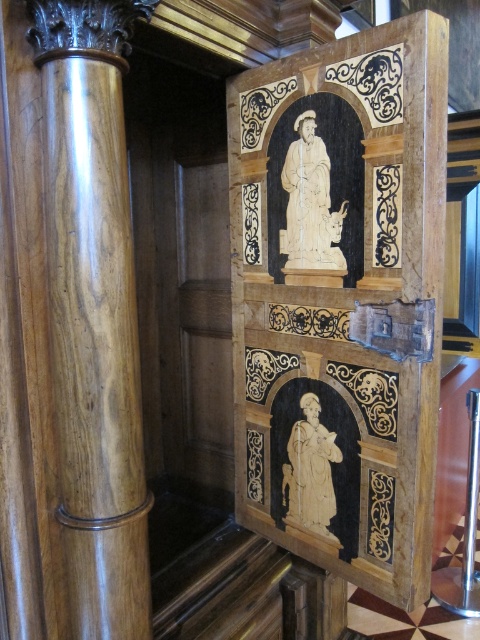
Does point (305, 192) come farther from viewer compared to point (305, 394)?

No, it is not.

Does white carved wood statue at center have a larger size compared to ivory statue at lower center?

Yes, white carved wood statue at center is bigger than ivory statue at lower center.

Describe the element at coordinates (310, 189) in the screenshot. I see `white carved wood statue at center` at that location.

Locate an element on the screen. white carved wood statue at center is located at coordinates (310, 189).

Identify the location of marble panel at center. The image size is (480, 640). (340, 300).

Who is lower down, marble panel at center or white carved wood statue at center?

Positioned lower is marble panel at center.

Is point (311, 51) behind point (278, 145)?

No, (311, 51) is in front of (278, 145).

Where is `marble panel at center`? The height and width of the screenshot is (640, 480). marble panel at center is located at coordinates (340, 300).

Is marble panel at center below ivory statue at lower center?

No.

Who is lower down, marble panel at center or ivory statue at lower center?

ivory statue at lower center

Is point (398, 442) positioned before point (324, 481)?

That is True.

Where is `marble panel at center`? marble panel at center is located at coordinates (340, 300).